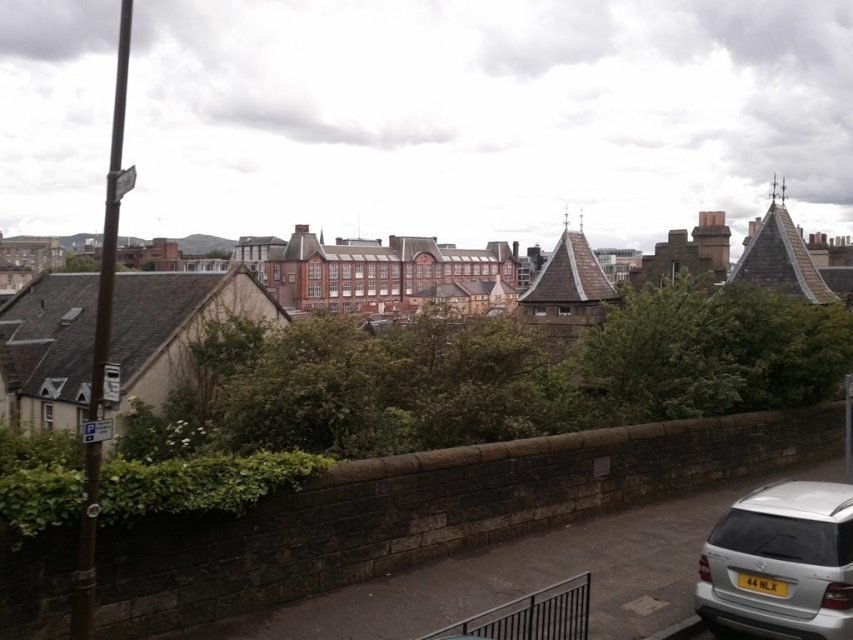
Question: Where is silver metallic suv at lower right located in relation to yellow matte license plate at lower right in the image?

Choices:
 (A) right
 (B) left

Answer: (A)

Question: Is silver metallic suv at lower right in front of yellow matte license plate at lower right?

Choices:
 (A) yes
 (B) no

Answer: (A)

Question: Which of the following is the farthest from the observer?

Choices:
 (A) silver metallic suv at lower right
 (B) yellow matte license plate at lower right

Answer: (B)

Question: In this image, where is silver metallic suv at lower right located relative to yellow matte license plate at lower right?

Choices:
 (A) above
 (B) below

Answer: (A)

Question: Which point appears farthest from the camera in this image?

Choices:
 (A) (773, 582)
 (B) (718, 588)

Answer: (B)